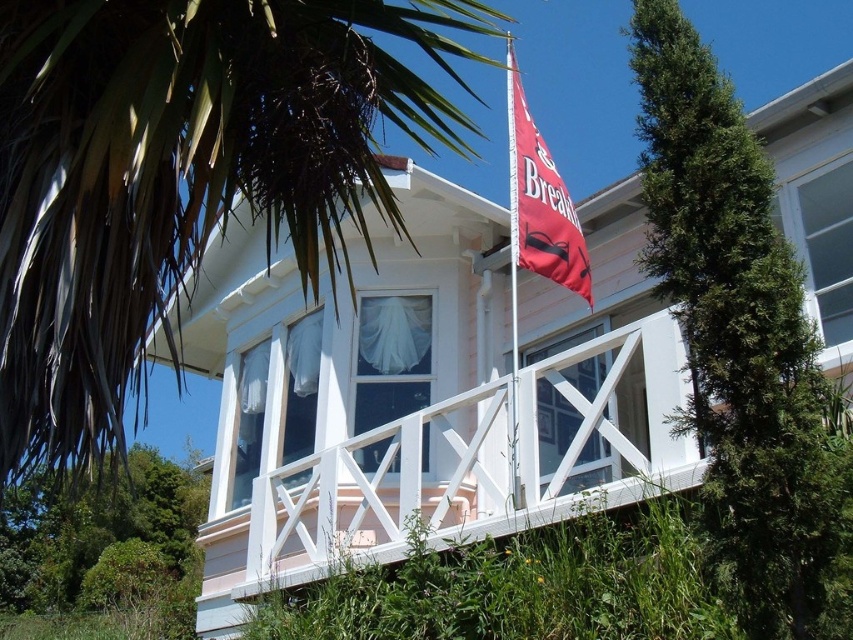
Based on the photo, between red fabric flag at upper center and metallic flag pole at center, which one is positioned lower?

red fabric flag at upper center is lower down.

Who is more forward, (555, 237) or (512, 154)?

Point (555, 237)

This screenshot has height=640, width=853. Describe the element at coordinates (540, 202) in the screenshot. I see `red fabric flag at upper center` at that location.

Locate an element on the screen. This screenshot has width=853, height=640. red fabric flag at upper center is located at coordinates click(x=540, y=202).

Which is above, green leafy palm tree at upper left or red fabric flag at upper center?

red fabric flag at upper center

Who is more distant from viewer, (x=100, y=240) or (x=572, y=204)?

Point (x=572, y=204)

At what (x,y) coordinates should I click in order to perform the action: click on green leafy palm tree at upper left. Please return your answer as a coordinate pair (x, y). This screenshot has height=640, width=853. Looking at the image, I should click on (180, 176).

Between green leafy palm tree at upper left and metallic flag pole at center, which one is positioned higher?

Positioned higher is metallic flag pole at center.

Can you confirm if green leafy palm tree at upper left is wider than metallic flag pole at center?

Yes, green leafy palm tree at upper left is wider than metallic flag pole at center.

Between point (340, 220) and point (518, 493), which one is positioned in front?

Point (518, 493) is in front.

Find the location of a particular element. This screenshot has width=853, height=640. green leafy palm tree at upper left is located at coordinates (180, 176).